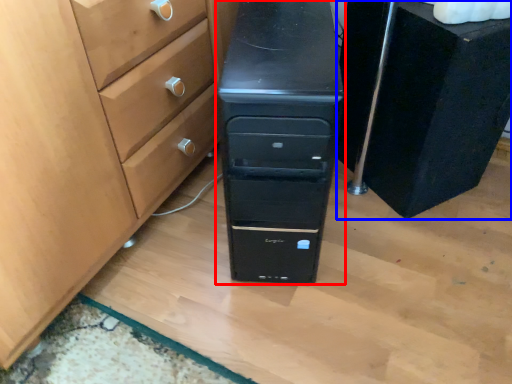
Question: Which of the following is the farthest to the observer, chest of drawers (highlighted by a red box) or chest of drawers (highlighted by a blue box)?

Choices:
 (A) chest of drawers
 (B) chest of drawers

Answer: (B)